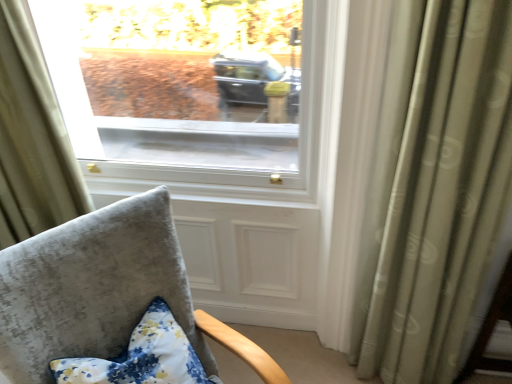
Locate an element on the screen. Image resolution: width=512 pixels, height=384 pixels. velvet gray chair at lower left is located at coordinates (103, 292).

You are a GUI agent. You are given a task and a screenshot of the screen. Output one action in this format:
    pyautogui.click(x=<x>, y=<y>)
    Task: Click on the velvet gray chair at lower left
    
    Given the screenshot: What is the action you would take?
    pyautogui.click(x=103, y=292)

Is floral fabric pillow at lower left taller or shorter than silky green curtain at right, which is the 1th curtain from right to left?

floral fabric pillow at lower left is shorter than silky green curtain at right, which is the 1th curtain from right to left.

Looking at this image, based on their positions, is floral fabric pillow at lower left located to the left or right of silky green curtain at right, which is the 1th curtain from right to left?

From the image, it's evident that floral fabric pillow at lower left is to the left of silky green curtain at right, which is the 1th curtain from right to left.

From a real-world perspective, is floral fabric pillow at lower left positioned over silky green curtain at right, which is the 1th curtain from right to left, based on gravity?

No.

Can you tell me how much floral fabric pillow at lower left and silky green curtain at right, which is the 2th curtain from left to right, differ in facing direction?

floral fabric pillow at lower left and silky green curtain at right, which is the 2th curtain from left to right, are facing 51.9 degrees away from each other.

Considering the relative sizes of floral fabric pillow at lower left and light beige fabric curtain at upper left, which ranks as the second curtain in right-to-left order, in the image provided, is floral fabric pillow at lower left taller than light beige fabric curtain at upper left, which ranks as the second curtain in right-to-left order,?

No.

Is point (173, 354) farther from camera compared to point (15, 159)?

No.

How many degrees apart are the facing directions of floral fabric pillow at lower left and light beige fabric curtain at upper left, which ranks as the second curtain in right-to-left order?

They differ by 51.9 degrees in their facing directions.

I want to click on pillow that is in front of the light beige fabric curtain at upper left, which ranks as the second curtain in right-to-left order, so click(x=141, y=357).

Between velvet gray chair at lower left and floral fabric pillow at lower left, which one has larger width?

With larger width is velvet gray chair at lower left.

Considering the points (175, 279) and (183, 355), which point is in front, point (175, 279) or point (183, 355)?

Positioned in front is point (183, 355).

From the image's perspective, is velvet gray chair at lower left positioned above or below floral fabric pillow at lower left?

velvet gray chair at lower left is situated lower than floral fabric pillow at lower left in the image.

Is velvet gray chair at lower left not close to floral fabric pillow at lower left?

They are positioned close to each other.

Is the position of light beige fabric curtain at upper left, which ranks as the second curtain in right-to-left order, less distant than that of floral fabric pillow at lower left?

No, the depth of light beige fabric curtain at upper left, which ranks as the second curtain in right-to-left order, is greater than that of floral fabric pillow at lower left.

Looking at this image, from the image's perspective, is light beige fabric curtain at upper left, the 1th curtain from the left, under floral fabric pillow at lower left?

No, from the image's perspective, light beige fabric curtain at upper left, the 1th curtain from the left, is not beneath floral fabric pillow at lower left.

Is light beige fabric curtain at upper left, which ranks as the second curtain in right-to-left order, positioned far away from floral fabric pillow at lower left?

light beige fabric curtain at upper left, which ranks as the second curtain in right-to-left order, is near floral fabric pillow at lower left, not far away.

Who is more distant, velvet gray chair at lower left or light beige fabric curtain at upper left, which ranks as the second curtain in right-to-left order?

light beige fabric curtain at upper left, which ranks as the second curtain in right-to-left order, is more distant.

Which point is more forward, (71,351) or (21,101)?

The point (71,351) is in front.

Looking at this image, is velvet gray chair at lower left looking in the opposite direction of light beige fabric curtain at upper left, the 1th curtain from the left?

Yes, velvet gray chair at lower left's orientation is away from light beige fabric curtain at upper left, the 1th curtain from the left.

At what (x,y) coordinates should I click in order to perform the action: click on chair below the light beige fabric curtain at upper left, the 1th curtain from the left (from a real-world perspective). Please return your answer as a coordinate pair (x, y). Looking at the image, I should click on (103, 292).

How many degrees apart are the facing directions of silky green curtain at right, which is the 2th curtain from left to right, and light beige fabric curtain at upper left, which ranks as the second curtain in right-to-left order?

The angle between the facing direction of silky green curtain at right, which is the 2th curtain from left to right, and the facing direction of light beige fabric curtain at upper left, which ranks as the second curtain in right-to-left order, is 0.00102 degrees.

From the image's perspective, who appears lower, silky green curtain at right, which is the 1th curtain from right to left, or light beige fabric curtain at upper left, the 1th curtain from the left?

silky green curtain at right, which is the 1th curtain from right to left.

Is silky green curtain at right, which is the 2th curtain from left to right, positioned before light beige fabric curtain at upper left, the 1th curtain from the left?

Yes, it is.

Is light beige fabric curtain at upper left, which ranks as the second curtain in right-to-left order, completely or partially inside silky green curtain at right, which is the 2th curtain from left to right?

No, light beige fabric curtain at upper left, which ranks as the second curtain in right-to-left order, is located outside of silky green curtain at right, which is the 2th curtain from left to right.

Considering the sizes of objects silky green curtain at right, which is the 1th curtain from right to left, and floral fabric pillow at lower left in the image provided, who is smaller, silky green curtain at right, which is the 1th curtain from right to left, or floral fabric pillow at lower left?

With smaller size is floral fabric pillow at lower left.

Does silky green curtain at right, which is the 1th curtain from right to left, lie in front of floral fabric pillow at lower left?

Yes, silky green curtain at right, which is the 1th curtain from right to left, is closer to the viewer.

Consider the image. From the image's perspective, would you say silky green curtain at right, which is the 1th curtain from right to left, is shown under floral fabric pillow at lower left?

No.

Locate an element on the screen. This screenshot has height=384, width=512. pillow behind the silky green curtain at right, which is the 2th curtain from left to right is located at coordinates (141, 357).

This screenshot has width=512, height=384. I want to click on pillow below the light beige fabric curtain at upper left, the 1th curtain from the left (from a real-world perspective), so click(141, 357).

Based on the photo, from the image, which object appears to be farther from light beige fabric curtain at upper left, which ranks as the second curtain in right-to-left order, velvet gray chair at lower left or silky green curtain at right, which is the 2th curtain from left to right?

silky green curtain at right, which is the 2th curtain from left to right.

Which object lies nearer to the anchor point floral fabric pillow at lower left, silky green curtain at right, which is the 2th curtain from left to right, or velvet gray chair at lower left?

velvet gray chair at lower left is closer to floral fabric pillow at lower left.

Which object lies nearer to the anchor point velvet gray chair at lower left, light beige fabric curtain at upper left, the 1th curtain from the left, or floral fabric pillow at lower left?

floral fabric pillow at lower left lies closer to velvet gray chair at lower left than the other object.

Estimate the real-world distances between objects in this image. Which object is closer to light beige fabric curtain at upper left, the 1th curtain from the left, silky green curtain at right, which is the 2th curtain from left to right, or floral fabric pillow at lower left?

The object closer to light beige fabric curtain at upper left, the 1th curtain from the left, is floral fabric pillow at lower left.

Which object lies nearer to the anchor point floral fabric pillow at lower left, velvet gray chair at lower left or light beige fabric curtain at upper left, which ranks as the second curtain in right-to-left order?

velvet gray chair at lower left is positioned closer to the anchor floral fabric pillow at lower left.

When comparing their distances from velvet gray chair at lower left, does silky green curtain at right, which is the 1th curtain from right to left, or floral fabric pillow at lower left seem closer?

floral fabric pillow at lower left lies closer to velvet gray chair at lower left than the other object.

Based on their spatial positions, is floral fabric pillow at lower left or silky green curtain at right, which is the 1th curtain from right to left, closer to velvet gray chair at lower left?

floral fabric pillow at lower left is closer to velvet gray chair at lower left.

Based on their spatial positions, is light beige fabric curtain at upper left, the 1th curtain from the left, or silky green curtain at right, which is the 1th curtain from right to left, closer to velvet gray chair at lower left?

light beige fabric curtain at upper left, the 1th curtain from the left.

The height and width of the screenshot is (384, 512). Find the location of `chair between light beige fabric curtain at upper left, which ranks as the second curtain in right-to-left order, and silky green curtain at right, which is the 2th curtain from left to right, in the horizontal direction`. chair between light beige fabric curtain at upper left, which ranks as the second curtain in right-to-left order, and silky green curtain at right, which is the 2th curtain from left to right, in the horizontal direction is located at coordinates (103, 292).

Where is `pillow located between light beige fabric curtain at upper left, the 1th curtain from the left, and silky green curtain at right, which is the 1th curtain from right to left, in the left-right direction`? pillow located between light beige fabric curtain at upper left, the 1th curtain from the left, and silky green curtain at right, which is the 1th curtain from right to left, in the left-right direction is located at coordinates (141, 357).

Identify the location of pillow between light beige fabric curtain at upper left, the 1th curtain from the left, and velvet gray chair at lower left in the up-down direction. (141, 357).

Where is `chair situated between floral fabric pillow at lower left and silky green curtain at right, which is the 2th curtain from left to right, from left to right`? The height and width of the screenshot is (384, 512). chair situated between floral fabric pillow at lower left and silky green curtain at right, which is the 2th curtain from left to right, from left to right is located at coordinates click(x=103, y=292).